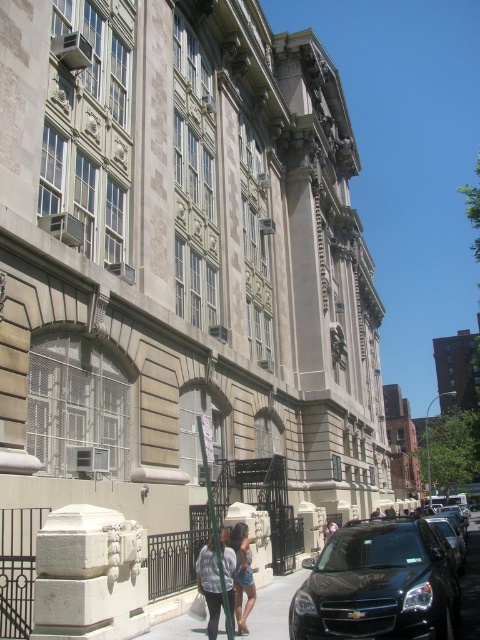
Which is in front, point (211, 540) or point (242, 586)?

Point (242, 586) is more forward.

Does point (226, 572) come in front of point (245, 593)?

Yes, it is.

Between point (247, 529) and point (242, 524), which one is positioned behind?

The point (242, 524) is more distant.

This screenshot has width=480, height=640. What are the coordinates of `denim jacket at lower center` in the screenshot? It's located at (238, 572).

Can you confirm if black matte car at lower right is bigger than denim jacket at lower center?

Yes.

Which is in front, point (432, 548) or point (211, 600)?

Point (432, 548)

At what (x,y) coordinates should I click in order to perform the action: click on black matte car at lower right. Please return your answer as a coordinate pair (x, y). Looking at the image, I should click on point(379,584).

Does black matte car at lower right have a greater width compared to black glossy car at lower right?

Correct, the width of black matte car at lower right exceeds that of black glossy car at lower right.

Image resolution: width=480 pixels, height=640 pixels. What are the coordinates of `black matte car at lower right` in the screenshot? It's located at (379, 584).

Which is in front, point (325, 576) or point (440, 528)?

Point (325, 576)

Image resolution: width=480 pixels, height=640 pixels. What are the coordinates of `black matte car at lower right` in the screenshot? It's located at (379, 584).